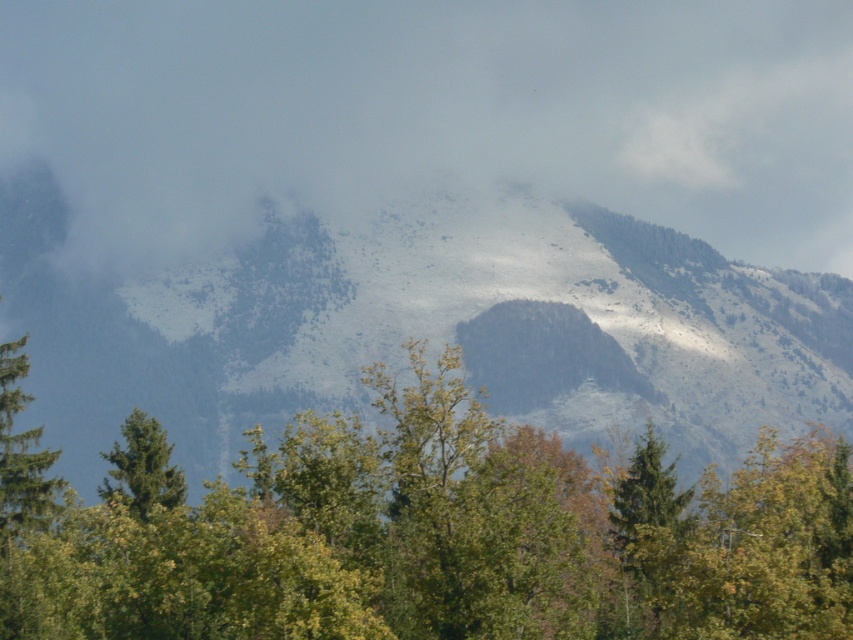
Question: Does green leafy tree at center appear over green matte tree at left?

Choices:
 (A) yes
 (B) no

Answer: (A)

Question: Which point is farther to the camera?

Choices:
 (A) (45, 493)
 (B) (303, 445)
 (C) (573, 310)

Answer: (C)

Question: Which point is farther to the camera?

Choices:
 (A) green matte tree at lower left
 (B) green leafy tree at center
 (C) white fluffy cloud at upper center

Answer: (C)

Question: Which is farther from the snowy rocky mountain at upper center?

Choices:
 (A) green matte tree at left
 (B) white fluffy cloud at upper center

Answer: (A)

Question: Can you confirm if green leafy tree at center is bigger than snowy rocky mountain at upper center?

Choices:
 (A) no
 (B) yes

Answer: (A)

Question: From the image, what is the correct spatial relationship of green leafy tree at center in relation to green matte tree at left?

Choices:
 (A) left
 (B) right

Answer: (B)